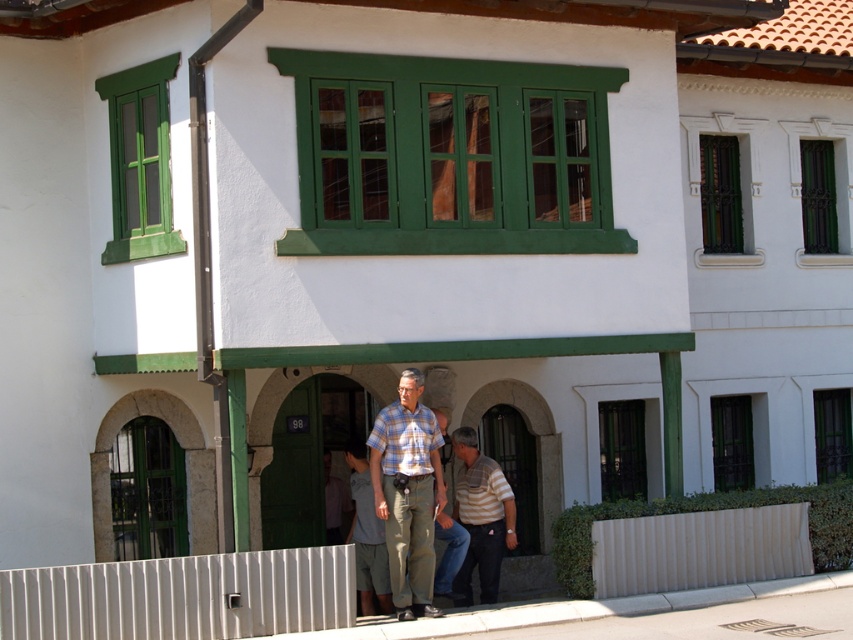
Is point (473, 548) positioned before point (328, 516)?

Yes, point (473, 548) is closer to viewer.

Can you confirm if striped cotton shirt at center is taller than light brown leather shirt at center?

Yes.

Is point (492, 468) more distant than point (325, 472)?

No, it is not.

Identify the location of striped cotton shirt at center. This screenshot has width=853, height=640. (480, 516).

Does plaid cotton shirt at center appear over green metal/glass window at upper center?

No, plaid cotton shirt at center is not above green metal/glass window at upper center.

Between plaid cotton shirt at center and green metal/glass window at upper center, which one appears on the right side from the viewer's perspective?

green metal/glass window at upper center

Is point (393, 461) less distant than point (705, 202)?

Yes.

Where is `plaid cotton shirt at center`? This screenshot has width=853, height=640. plaid cotton shirt at center is located at coordinates (407, 493).

Between point (428, 608) and point (343, 481), which one is positioned behind?

Positioned behind is point (343, 481).

Between plaid cotton shirt at center and light brown leather shirt at center, which one has more height?

plaid cotton shirt at center is taller.

I want to click on plaid cotton shirt at center, so click(x=407, y=493).

The width and height of the screenshot is (853, 640). In order to click on plaid cotton shirt at center in this screenshot , I will do `click(407, 493)`.